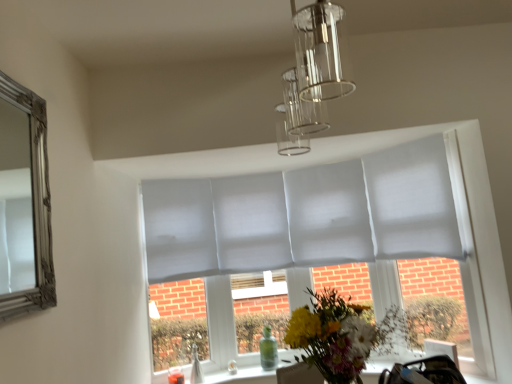
Question: In terms of height, does clear glass vase at lower center, the 2th glass vase viewed from the right, look taller or shorter compared to fluffy bouquet at center?

Choices:
 (A) tall
 (B) short

Answer: (B)

Question: Relative to fluffy bouquet at center, is clear glass vase at lower center, which ranks as the 1th glass vase in front-to-back order, in front or behind?

Choices:
 (A) front
 (B) behind

Answer: (B)

Question: Which of these objects is positioned farthest from the fluffy bouquet at center?

Choices:
 (A) transparent glass vase at lower center, which ranks as the 1th glass vase in back-to-front order
 (B) clear glass vase at lower center, the 2th glass vase viewed from the right
 (C) clear glass chandelier at upper center

Answer: (B)

Question: Which object is positioned farthest from the fluffy bouquet at center?

Choices:
 (A) clear glass vase at lower center, marked as the second glass vase in a back-to-front arrangement
 (B) clear glass chandelier at upper center
 (C) transparent glass vase at lower center, which is the 1th glass vase in right-to-left order

Answer: (A)